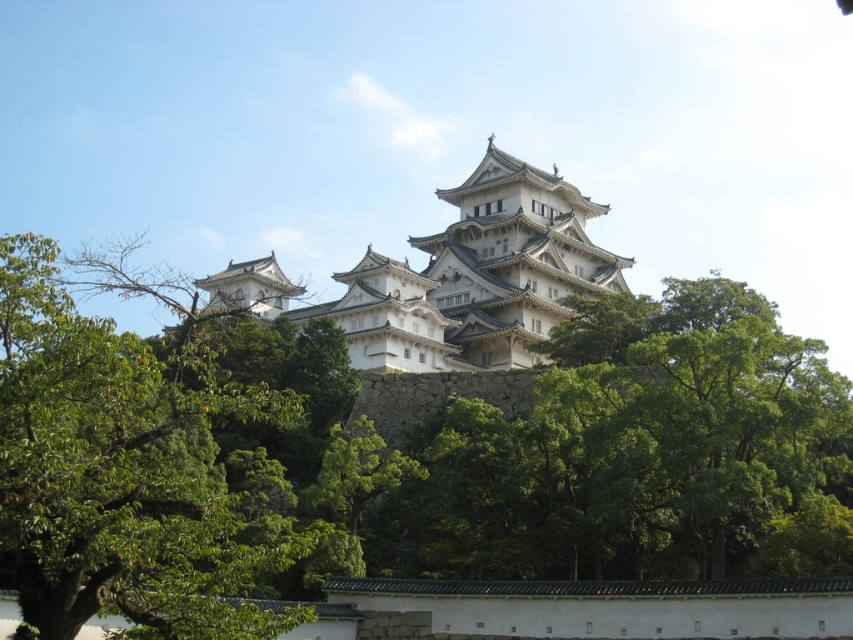
Question: Observing the image, what is the correct spatial positioning of green leafy tree at center in reference to white stone castle at center?

Choices:
 (A) above
 (B) below

Answer: (B)

Question: Which object is the closest to the green leafy tree at left?

Choices:
 (A) green leafy tree at center
 (B) white stone castle at center

Answer: (A)

Question: Does green leafy tree at center appear on the right side of white stone castle at center?

Choices:
 (A) yes
 (B) no

Answer: (A)

Question: Can you confirm if green leafy tree at left is wider than white stone castle at center?

Choices:
 (A) yes
 (B) no

Answer: (B)

Question: Which point appears closest to the camera in this image?

Choices:
 (A) (119, 410)
 (B) (538, 296)
 (C) (494, 506)

Answer: (A)

Question: Which object is the closest to the green leafy tree at center?

Choices:
 (A) white stone castle at center
 (B) green leafy tree at left

Answer: (A)